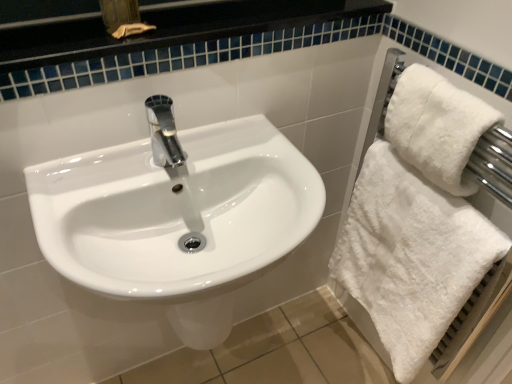
The image size is (512, 384). I want to click on white glossy sink at center, so click(x=178, y=216).

Find the location of a particular element. The height and width of the screenshot is (384, 512). white fluffy towel at right is located at coordinates (411, 257).

The image size is (512, 384). Find the location of `white glossy sink at center`. white glossy sink at center is located at coordinates (178, 216).

Is white fluffy towel at right in front of white glossy sink at center?

No, it is not.

The width and height of the screenshot is (512, 384). Find the location of `bath towel lying above the white glossy sink at center (from the image's perspective)`. bath towel lying above the white glossy sink at center (from the image's perspective) is located at coordinates (426, 108).

Is point (380, 129) farther from camera compared to point (211, 227)?

Yes, it is.

Is white fluffy towel at right placed right next to white glossy sink at center?

No, white fluffy towel at right is not touching white glossy sink at center.

Could you tell me if white fluffy towel at right is turned towards white fluffy towel at right?

No, white fluffy towel at right is not oriented towards white fluffy towel at right.

Where is `towel behind the white fluffy towel at right`? This screenshot has height=384, width=512. towel behind the white fluffy towel at right is located at coordinates (411, 257).

From a real-world perspective, is white fluffy towel at right beneath white fluffy towel at right?

Yes, from a real-world perspective, white fluffy towel at right is below white fluffy towel at right.

Which is nearer, (392, 275) or (406, 134)?

Point (392, 275) is positioned farther from the camera compared to point (406, 134).

From the image's perspective, between white fluffy towel at right and white glossy sink at center, who is located below?

From the image's view, white fluffy towel at right is below.

How many degrees apart are the facing directions of white fluffy towel at right and white glossy sink at center?

89.4 degrees.

Is white fluffy towel at right touching white glossy sink at center?

No, white fluffy towel at right is not next to white glossy sink at center.

From a real-world perspective, is white fluffy towel at right positioned under white glossy sink at center based on gravity?

Yes, from a real-world perspective, white fluffy towel at right is under white glossy sink at center.

Does white glossy sink at center contain white fluffy towel at right?

Definitely not — white fluffy towel at right is not inside white glossy sink at center.

From the image's perspective, does white glossy sink at center appear lower than white fluffy towel at right?

Actually, white glossy sink at center appears above white fluffy towel at right in the image.

How different are the orientations of white glossy sink at center and white fluffy towel at right in degrees?

There is a 89.4-degree angle between the facing directions of white glossy sink at center and white fluffy towel at right.

Does point (41, 242) lie behind point (362, 295)?

No, it is in front of (362, 295).

From a real-world perspective, which is physically below, white fluffy towel at right or white fluffy towel at right?

In real-world perspective, white fluffy towel at right is lower.

You are a GUI agent. You are given a task and a screenshot of the screen. Output one action in this format:
    pyautogui.click(x=<x>, y=<y>)
    Task: Click on the towel directly beneath the white fluffy towel at right (from a real-world perspective)
    
    Given the screenshot: What is the action you would take?
    [411, 257]

Is white fluffy towel at right smaller than white fluffy towel at right?

Indeed, white fluffy towel at right has a smaller size compared to white fluffy towel at right.

Would you say white glossy sink at center is outside white fluffy towel at right?

Yes, white glossy sink at center is not within white fluffy towel at right.

Locate an element on the screen. sink in front of the white fluffy towel at right is located at coordinates (178, 216).

Is white glossy sink at center turned away from white fluffy towel at right?

That's not correct — white glossy sink at center is not looking away from white fluffy towel at right.

Is white glossy sink at center to the left or to the right of white fluffy towel at right in the image?

From the image, it's evident that white glossy sink at center is to the left of white fluffy towel at right.

Locate an element on the screen. bath towel located above the white glossy sink at center (from the image's perspective) is located at coordinates (426, 108).

What are the coordinates of `towel below the white fluffy towel at right (from a real-world perspective)` in the screenshot? It's located at (411, 257).

Which object lies nearer to the anchor point white glossy sink at center, white fluffy towel at right or white fluffy towel at right?

Based on the image, white fluffy towel at right appears to be nearer to white glossy sink at center.

In the scene shown: Which object lies further to the anchor point white fluffy towel at right, white fluffy towel at right or white glossy sink at center?

The object further to white fluffy towel at right is white glossy sink at center.

Estimate the real-world distances between objects in this image. Which object is closer to white fluffy towel at right, white fluffy towel at right or white glossy sink at center?

The object closer to white fluffy towel at right is white fluffy towel at right.

Looking at the image, which one is located closer to white fluffy towel at right, white glossy sink at center or white fluffy towel at right?

white fluffy towel at right.

Considering their positions, is white fluffy towel at right positioned further to white glossy sink at center than white fluffy towel at right?

Based on the image, white fluffy towel at right appears to be further to white glossy sink at center.

Estimate the real-world distances between objects in this image. Which object is further from white fluffy towel at right, white glossy sink at center or white fluffy towel at right?

white glossy sink at center is further to white fluffy towel at right.

Image resolution: width=512 pixels, height=384 pixels. Find the location of `towel situated between white glossy sink at center and white fluffy towel at right from left to right`. towel situated between white glossy sink at center and white fluffy towel at right from left to right is located at coordinates (411, 257).